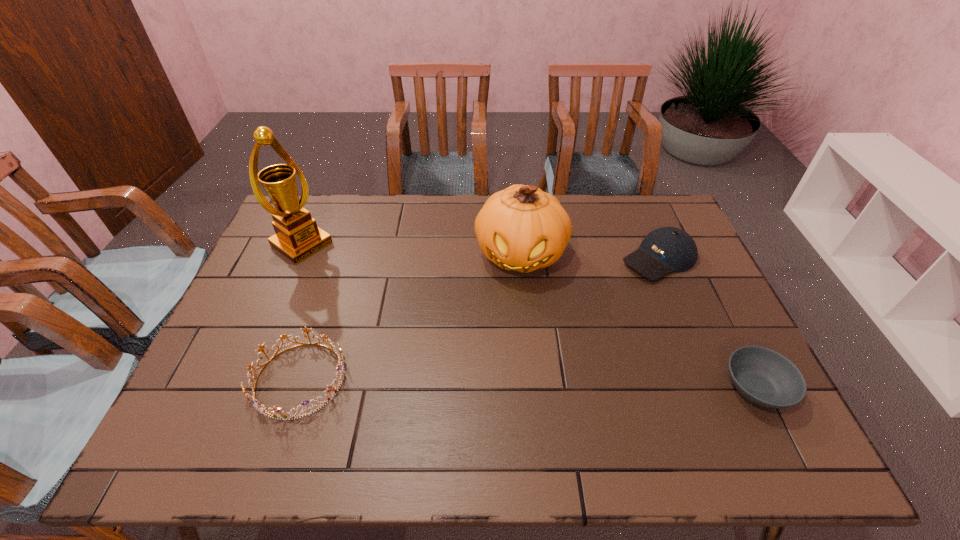
I want to click on free spot on the desktop that is between the fourth tallest object and the soup bowl and is positioned on the front-facing side of the award, so click(x=497, y=383).

Locate an element on the screen. Image resolution: width=960 pixels, height=540 pixels. vacant space on the desktop that is between the second shortest object and the soup bowl and is positioned on the front face of the second tallest object is located at coordinates (504, 383).

The width and height of the screenshot is (960, 540). I want to click on vacant spot on the desktop that is between the tiara and the shortest object and is positioned on the front-facing side of the baseball cap, so click(x=460, y=383).